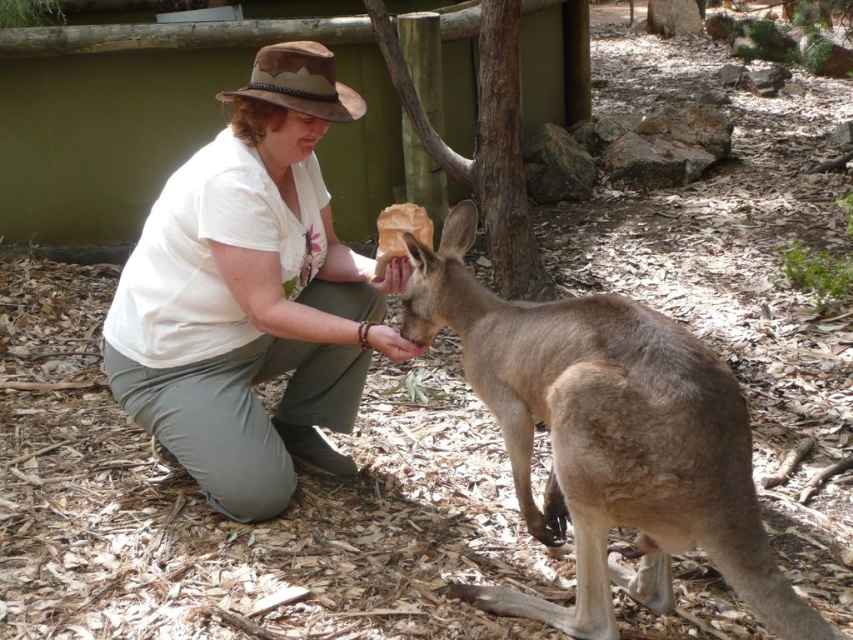
Looking at this image, does white cotton shirt at center have a lesser height compared to light brown fur at center?

In fact, white cotton shirt at center may be taller than light brown fur at center.

Between point (375, 333) and point (616, 579), which one is positioned in front?

Point (616, 579) is more forward.

Locate an element on the screen. white cotton shirt at center is located at coordinates (251, 296).